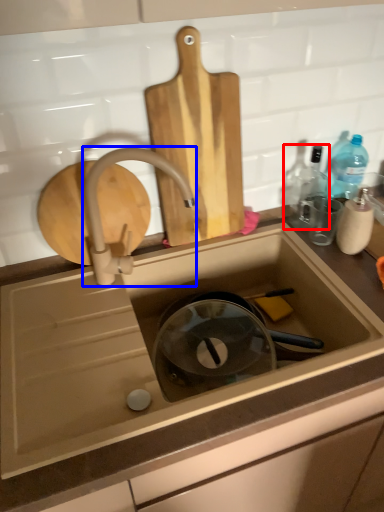
Question: Which of the following is the farthest to the observer, bottle (highlighted by a red box) or tap (highlighted by a blue box)?

Choices:
 (A) bottle
 (B) tap

Answer: (A)